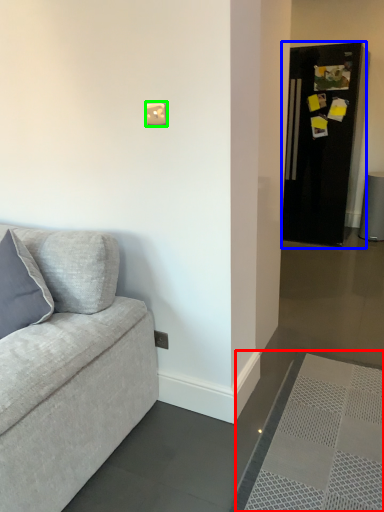
Question: Based on their relative distances, which object is nearer to doormat (highlighted by a red box)? Choose from fridge (highlighted by a blue box) and light switch (highlighted by a green box).

Choices:
 (A) fridge
 (B) light switch

Answer: (B)